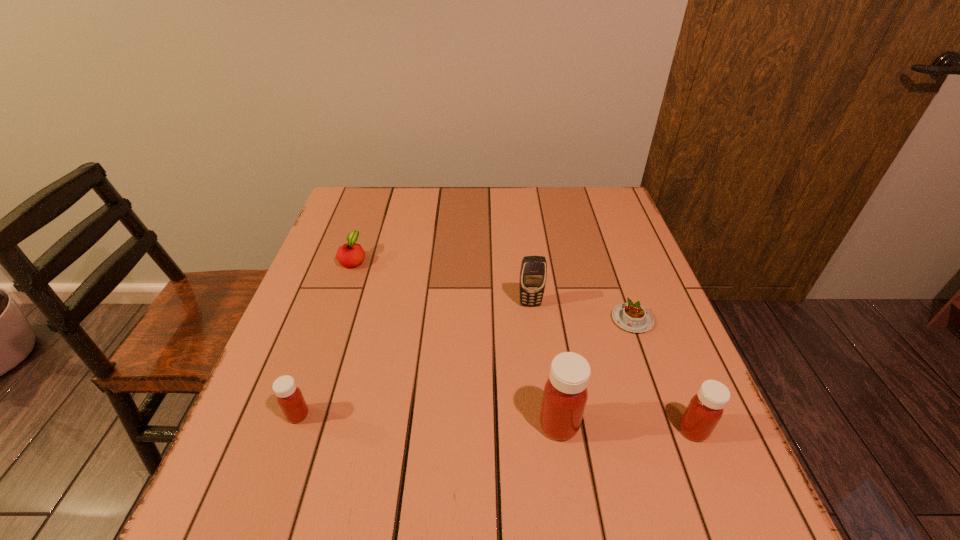
What are the coordinates of `object that is at the near left corner` in the screenshot? It's located at (289, 397).

At what (x,y) coordinates should I click in order to perform the action: click on object that is at the near right corner. Please return your answer as a coordinate pair (x, y). The width and height of the screenshot is (960, 540). Looking at the image, I should click on (705, 409).

This screenshot has height=540, width=960. In order to click on vacant space at the far edge of the desktop in this screenshot , I will do `click(514, 207)`.

The image size is (960, 540). I want to click on vacant space at the near edge, so pos(495,462).

You are a GUI agent. You are given a task and a screenshot of the screen. Output one action in this format:
    pyautogui.click(x=<x>, y=<y>)
    Task: Click on the vacant space at the left edge of the desktop
    The image size is (960, 540).
    Given the screenshot: What is the action you would take?
    pyautogui.click(x=375, y=256)

Locate an element on the screen. The height and width of the screenshot is (540, 960). free location at the right edge of the desktop is located at coordinates (644, 354).

You are a GUI agent. You are given a task and a screenshot of the screen. Output one action in this format:
    pyautogui.click(x=<x>, y=<y>)
    Task: Click on the vacant space at the far left corner of the desktop
    Image resolution: width=960 pixels, height=540 pixels.
    Given the screenshot: What is the action you would take?
    pyautogui.click(x=371, y=200)

At what (x,y) coordinates should I click in order to perform the action: click on free space at the far right corner of the desktop. Please return your answer as a coordinate pair (x, y). The image size is (960, 540). Looking at the image, I should click on tap(602, 211).

At what (x,y) coordinates should I click in order to perform the action: click on empty location between the shortest medicine and the second shortest medicine. Please return your answer as a coordinate pair (x, y). This screenshot has height=540, width=960. Looking at the image, I should click on (495, 422).

The width and height of the screenshot is (960, 540). What are the coordinates of `vacant space that's between the third shortest object and the pudding` in the screenshot? It's located at (465, 367).